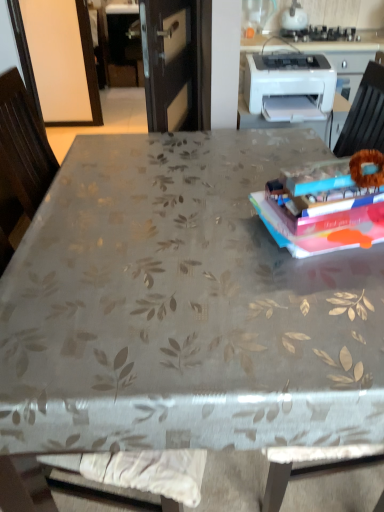
At what (x,y) coordinates should I click in order to perform the action: click on free space to the left of hardcover book at upper right. Please return your answer as a coordinate pair (x, y). This screenshot has width=384, height=512. Looking at the image, I should click on (203, 237).